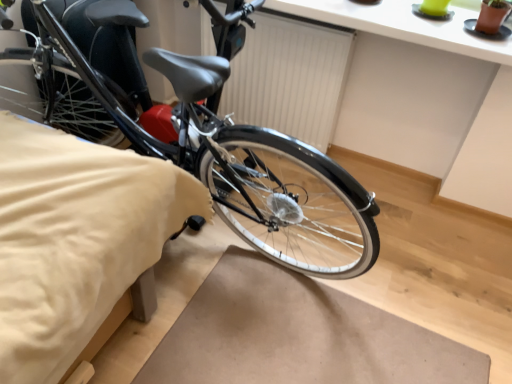
Question: Considering the relative sizes of shiny black bicycle at left and white matte radiator at center in the image provided, is shiny black bicycle at left bigger than white matte radiator at center?

Choices:
 (A) yes
 (B) no

Answer: (A)

Question: From the image's perspective, is shiny black bicycle at left located beneath white matte radiator at center?

Choices:
 (A) yes
 (B) no

Answer: (A)

Question: Does shiny black bicycle at left have a greater width compared to white matte radiator at center?

Choices:
 (A) no
 (B) yes

Answer: (B)

Question: From the image's perspective, is shiny black bicycle at left on white matte radiator at center?

Choices:
 (A) yes
 (B) no

Answer: (B)

Question: Is shiny black bicycle at left positioned far away from white matte radiator at center?

Choices:
 (A) no
 (B) yes

Answer: (A)

Question: Is shiny black bicycle at left to the right of white matte radiator at center from the viewer's perspective?

Choices:
 (A) no
 (B) yes

Answer: (A)

Question: Is beige fabric bedsheet at lower left positioned before shiny black bicycle at left?

Choices:
 (A) yes
 (B) no

Answer: (A)

Question: Does beige fabric bedsheet at lower left appear on the left side of shiny black bicycle at left?

Choices:
 (A) no
 (B) yes

Answer: (B)

Question: From a real-world perspective, is beige fabric bedsheet at lower left beneath shiny black bicycle at left?

Choices:
 (A) yes
 (B) no

Answer: (A)

Question: Is beige fabric bedsheet at lower left shorter than shiny black bicycle at left?

Choices:
 (A) no
 (B) yes

Answer: (B)

Question: Considering the relative sizes of beige fabric bedsheet at lower left and shiny black bicycle at left in the image provided, is beige fabric bedsheet at lower left bigger than shiny black bicycle at left?

Choices:
 (A) no
 (B) yes

Answer: (B)

Question: Is beige fabric bedsheet at lower left beside shiny black bicycle at left?

Choices:
 (A) no
 (B) yes

Answer: (A)

Question: From a real-world perspective, is white matte radiator at center physically below shiny black bicycle at left?

Choices:
 (A) yes
 (B) no

Answer: (A)